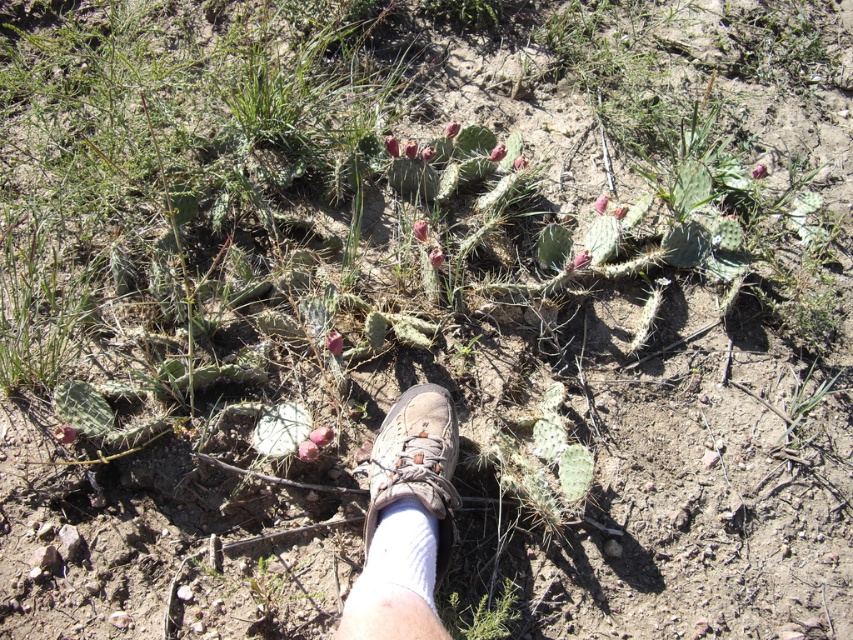
Question: Which of the following is the farthest from the observer?

Choices:
 (A) brown suede shoe at center
 (B) green spiky cactus at lower center

Answer: (B)

Question: Is brown suede shoe at center to the left of green spiky cactus at lower center from the viewer's perspective?

Choices:
 (A) no
 (B) yes

Answer: (B)

Question: Which point appears farthest from the camera in this image?

Choices:
 (A) click(508, 604)
 (B) click(434, 480)

Answer: (A)

Question: Among these objects, which one is farthest from the camera?

Choices:
 (A) brown suede shoe at center
 (B) green spiky cactus at lower center

Answer: (B)

Question: Can you confirm if brown suede shoe at center is thinner than green spiky cactus at lower center?

Choices:
 (A) yes
 (B) no

Answer: (B)

Question: Is brown suede shoe at center above green spiky cactus at lower center?

Choices:
 (A) yes
 (B) no

Answer: (A)